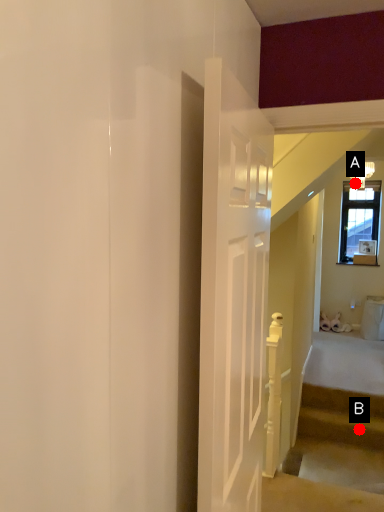
Question: Two points are circled on the image, labeled by A and B beside each circle. Which point is closer to the camera taking this photo?

Choices:
 (A) A is closer
 (B) B is closer

Answer: (B)